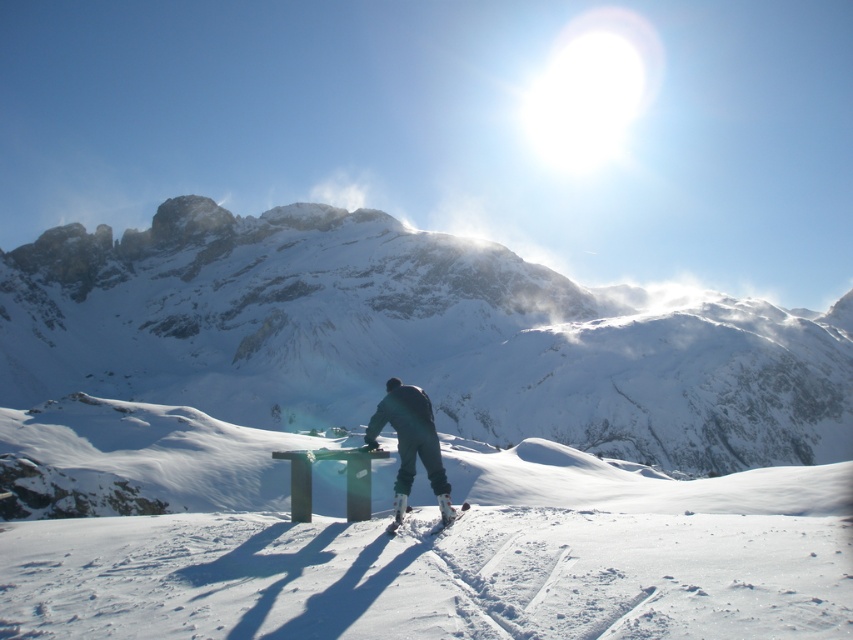
From the picture: Does dark blue snow pants at center appear on the left side of white matte snowboard at lower center?

Yes, dark blue snow pants at center is to the left of white matte snowboard at lower center.

Can you confirm if dark blue snow pants at center is bigger than white matte snowboard at lower center?

Correct, dark blue snow pants at center is larger in size than white matte snowboard at lower center.

This screenshot has height=640, width=853. What are the coordinates of `dark blue snow pants at center` in the screenshot? It's located at (410, 445).

Is point (361, 214) positioned behind point (405, 387)?

Yes, it is behind point (405, 387).

Which is above, snowy rock mountain at center or dark blue snow pants at center?

snowy rock mountain at center is higher up.

Does point (675, 339) come closer to viewer compared to point (434, 465)?

No, it is not.

This screenshot has height=640, width=853. Identify the location of snowy rock mountain at center. click(415, 339).

Which is behind, point (769, 429) or point (407, 512)?

Point (769, 429)

Is snowy rock mountain at center to the left of white matte snowboard at lower center from the viewer's perspective?

In fact, snowy rock mountain at center is to the right of white matte snowboard at lower center.

Locate an element on the screen. The image size is (853, 640). snowy rock mountain at center is located at coordinates (415, 339).